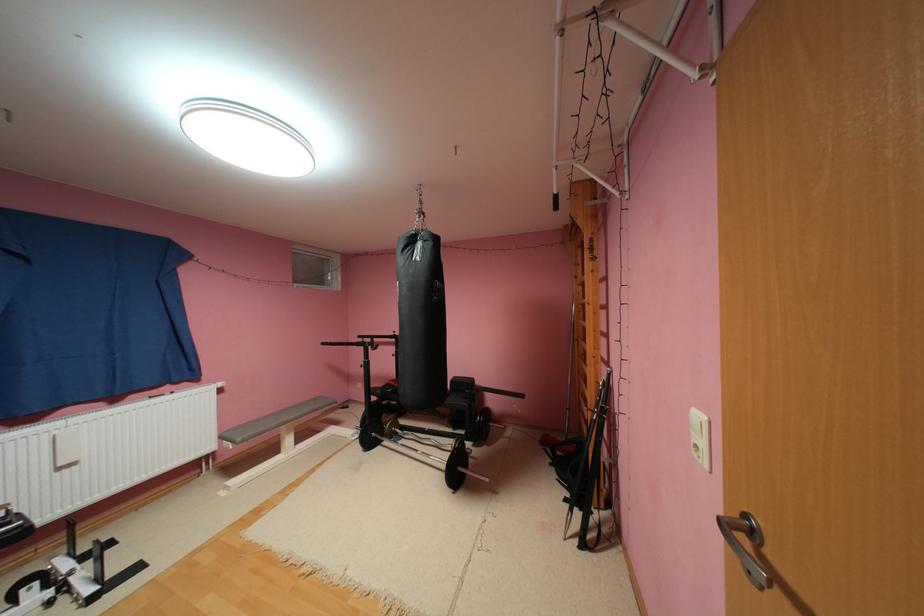
The width and height of the screenshot is (924, 616). Find the location of `white radiator valve`. white radiator valve is located at coordinates (65, 453).